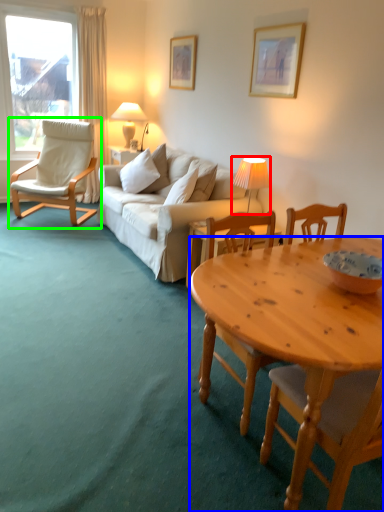
Question: Based on their relative distances, which object is farther from lamp (highlighted by a red box)? Choose from desk (highlighted by a blue box) and chair (highlighted by a green box).

Choices:
 (A) desk
 (B) chair

Answer: (B)